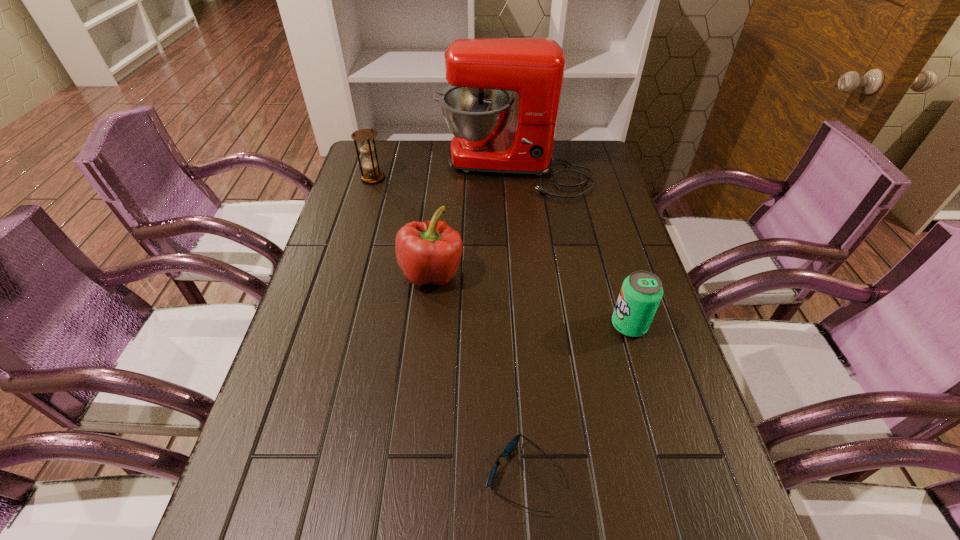
Find the location of `object that is at the far left corner`. object that is at the far left corner is located at coordinates (366, 146).

Where is `object situated at the far right corner`? The height and width of the screenshot is (540, 960). object situated at the far right corner is located at coordinates (482, 72).

Image resolution: width=960 pixels, height=540 pixels. Identify the location of free space at the far edge. (433, 165).

Identify the location of vacant space at the left edge. The image size is (960, 540). click(x=341, y=402).

Identify the location of vacant space at the right edge. This screenshot has height=540, width=960. (588, 282).

This screenshot has width=960, height=540. In order to click on blank space at the far right corner of the desktop in this screenshot , I will do `click(579, 147)`.

Identify the location of free area in between the third farthest object and the hourglass. This screenshot has height=540, width=960. (402, 226).

Identify the location of empty space between the tallest object and the sunglasses. Image resolution: width=960 pixels, height=540 pixels. (518, 323).

In order to click on vacant space in between the leftmost object and the tallest object in this screenshot , I will do `click(443, 174)`.

The image size is (960, 540). Find the location of `free point between the leftmost object and the tallest object`. free point between the leftmost object and the tallest object is located at coordinates (443, 174).